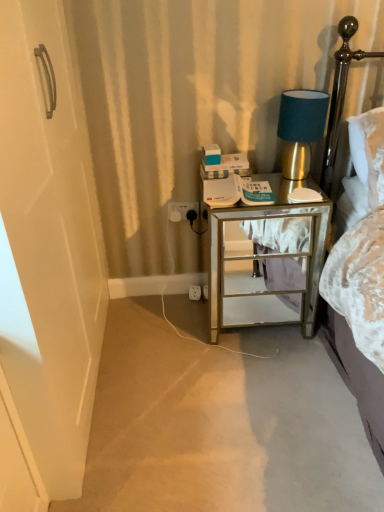
Identify the location of vacant space to the left of mirrored glass nightstand at right. The height and width of the screenshot is (512, 384). (168, 338).